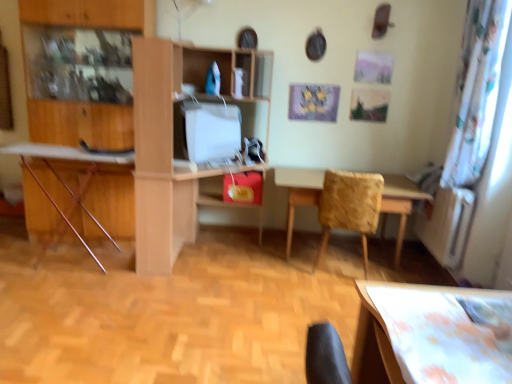
The width and height of the screenshot is (512, 384). Find the location of `free location in front of wooden ironing board at left`. free location in front of wooden ironing board at left is located at coordinates (54, 296).